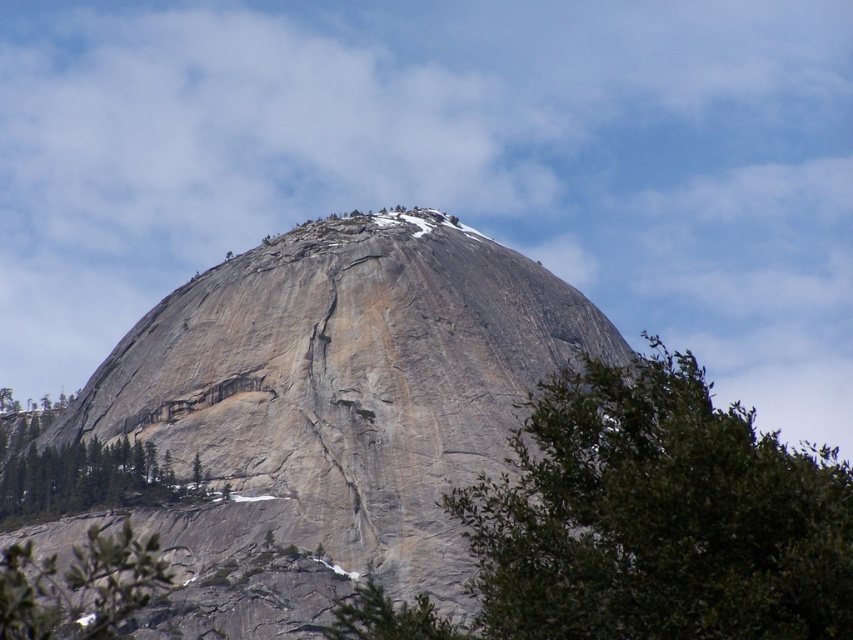
Does gray rock formation at center have a lesser width compared to green leafy tree at center?

Indeed, gray rock formation at center has a lesser width compared to green leafy tree at center.

Is point (194, 340) in front of point (585, 552)?

No, it is not.

At what (x,y) coordinates should I click in order to perform the action: click on gray rock formation at center. Please return your answer as a coordinate pair (x, y). The width and height of the screenshot is (853, 640). Looking at the image, I should click on (331, 412).

Does green textured tree at lower left have a larger size compared to green leafy tree at lower left?

Indeed, green textured tree at lower left has a larger size compared to green leafy tree at lower left.

Does green textured tree at lower left appear under green leafy tree at lower left?

No.

Which is behind, point (38, 408) or point (62, 600)?

The point (38, 408) is more distant.

The image size is (853, 640). I want to click on green textured tree at lower left, so click(x=76, y=468).

Between gray rock formation at center and green leafy tree at lower left, which one is positioned higher?

gray rock formation at center is above.

Which is below, gray rock formation at center or green leafy tree at lower left?

Positioned lower is green leafy tree at lower left.

Describe the element at coordinates (331, 412) in the screenshot. The image size is (853, 640). I see `gray rock formation at center` at that location.

The width and height of the screenshot is (853, 640). I want to click on gray rock formation at center, so click(x=331, y=412).